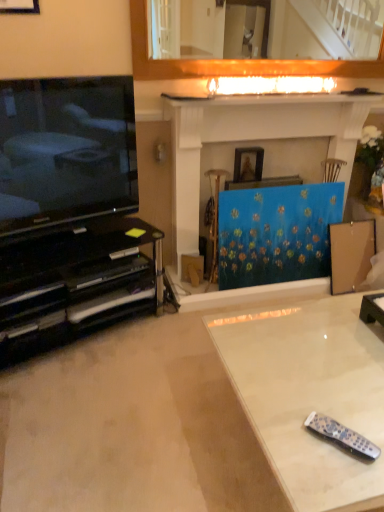
Find the location of a particular element. vacant area to the left of white glossy table at lower right is located at coordinates (132, 418).